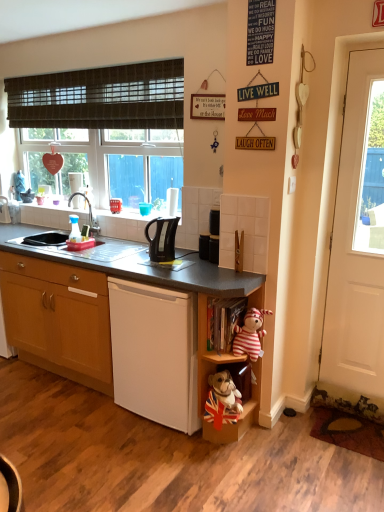
Where is `vacant region in front of black plastic kettle at center`? This screenshot has height=512, width=384. vacant region in front of black plastic kettle at center is located at coordinates (161, 263).